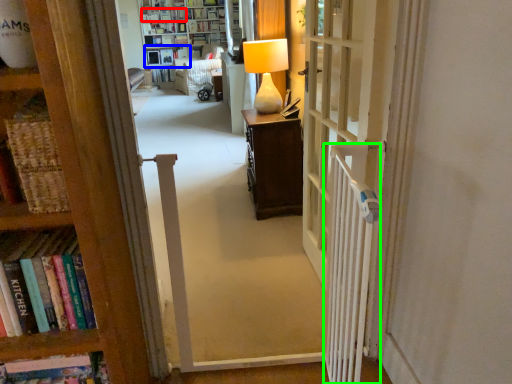
Question: Which object is the farthest from book (highlighted by a red box)? Choose among these: shelf (highlighted by a blue box) or radiator (highlighted by a green box).

Choices:
 (A) shelf
 (B) radiator

Answer: (B)